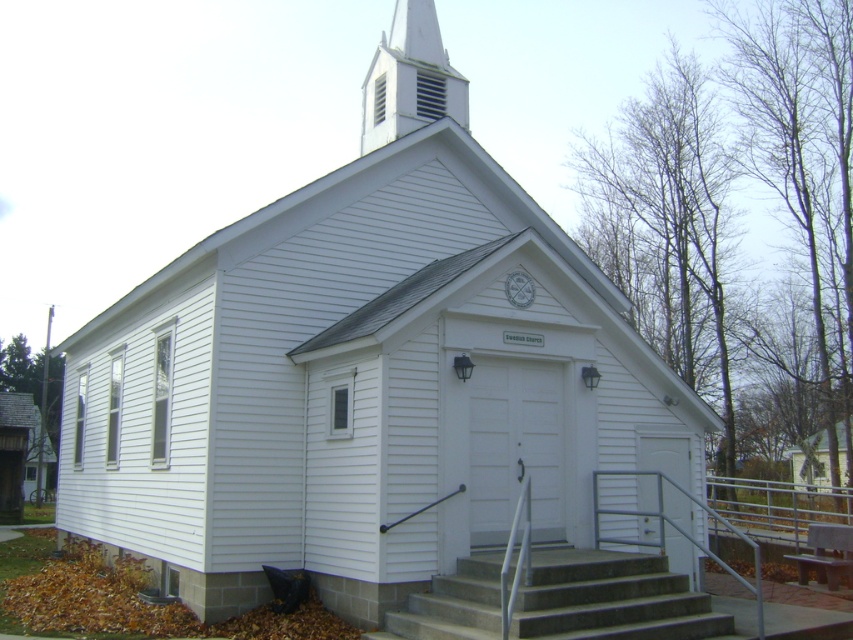
Question: Among these objects, which one is farthest from the camera?

Choices:
 (A) concrete/steps at lower center
 (B) white wood spire at upper center

Answer: (B)

Question: Which point is closer to the camera taking this photo?

Choices:
 (A) (392, 49)
 (B) (705, 627)

Answer: (B)

Question: From the image, what is the correct spatial relationship of concrete/steps at lower center in relation to white wood spire at upper center?

Choices:
 (A) below
 (B) above

Answer: (A)

Question: Does concrete/steps at lower center have a smaller size compared to white wood spire at upper center?

Choices:
 (A) no
 (B) yes

Answer: (B)

Question: Which of the following is the closest to the observer?

Choices:
 (A) concrete/steps at lower center
 (B) white wood spire at upper center

Answer: (A)

Question: Can you confirm if concrete/steps at lower center is thinner than white wood spire at upper center?

Choices:
 (A) yes
 (B) no

Answer: (B)